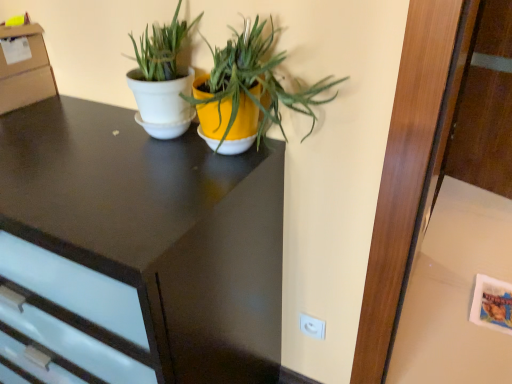
Locate an element on the screen. free space that is to the left of white glossy pot at center, marked as the second houseplant in a right-to-left arrangement is located at coordinates pos(87,145).